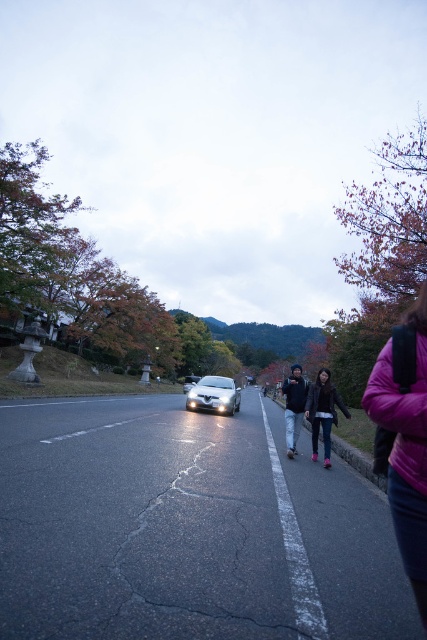
You are a pedestrian standing on the sidewalk bordered by the low stone wall. You see a purple fleece jacket at lower right and a dark brown leather jacket at center. Which jacket is closer to the road?

The purple fleece jacket at lower right is positioned on the left side of the dark brown leather jacket at center. Since the dark brown leather jacket at center is further from the road compared to the purple fleece jacket at lower right, the purple fleece jacket at lower right is closer to the road.

You are a delivery person riding a bicycle that is 1.2 meters wide. You are on the two lane road and want to pass between the silver metallic car at center and dark blue jeans at center. Is there enough space for your bicycle to pass through?

The distance between the silver metallic car at center and dark blue jeans at center is 4.70 meters. Since your bicycle is only 1.2 meters wide, there is more than enough space to pass safely between them.

You are standing on the sidewalk next to the low stone wall. You see a dark blue jeans at center and a glossy white car at center. Which object is closer to you?

The dark blue jeans at center is closer to you since it is only 37.69 meters away from the glossy white car at center, but without knowing your exact position, it is impossible to determine the exact distance from you to each object.